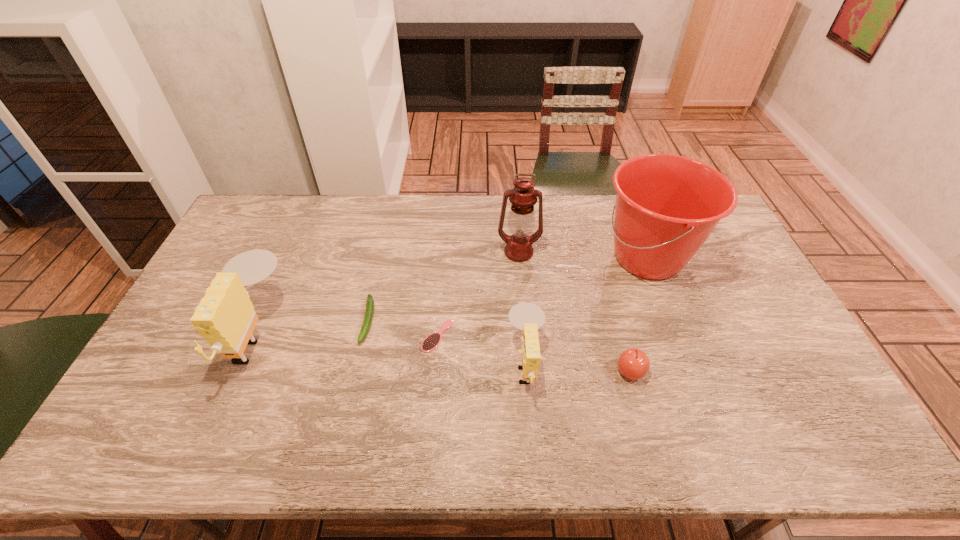
The image size is (960, 540). What are the coordinates of `free space between the fifth tallest object and the right sponge` in the screenshot? It's located at (578, 368).

Where is `object that is the fourth nearest to the bucket`? The width and height of the screenshot is (960, 540). object that is the fourth nearest to the bucket is located at coordinates (432, 341).

Select which object is the closest to the left sponge. Please provide its 2D coordinates. Your answer should be formatted as a tuple, i.e. [(x, y)], where the tuple contains the x and y coordinates of a point satisfying the conditions above.

[(368, 317)]

Locate an element on the screen. The width and height of the screenshot is (960, 540). free space in the image that satisfies the following two spatial constraints: 1. on the front side of the shortest object; 2. on the front-facing side of the left sponge is located at coordinates pos(437,336).

Find the location of a particular element. The height and width of the screenshot is (540, 960). vacant space that satisfies the following two spatial constraints: 1. on the front-facing side of the second object from left to right; 2. on the right side of the shortest object is located at coordinates (365, 336).

Locate an element on the screen. The width and height of the screenshot is (960, 540). vacant space that satisfies the following two spatial constraints: 1. on the back side of the third shortest object; 2. on the front-facing side of the right sponge is located at coordinates (629, 364).

The width and height of the screenshot is (960, 540). Identify the location of vacant space that satisfies the following two spatial constraints: 1. on the front-facing side of the apple; 2. on the left side of the left sponge. (241, 372).

Identify the location of free space that satisfies the following two spatial constraints: 1. on the back side of the oil lamp; 2. on the left side of the fifth object from right to left. (444, 252).